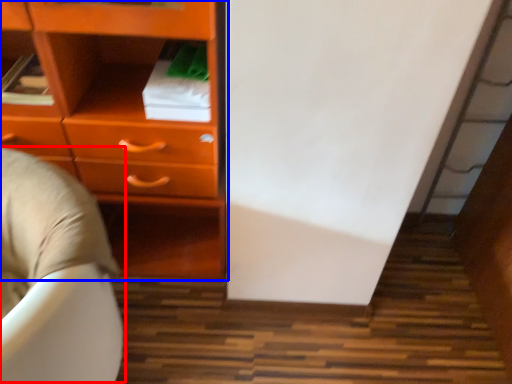
Question: Which object is further to the camera taking this photo, bean bag chair (highlighted by a red box) or chest of drawers (highlighted by a blue box)?

Choices:
 (A) bean bag chair
 (B) chest of drawers

Answer: (B)